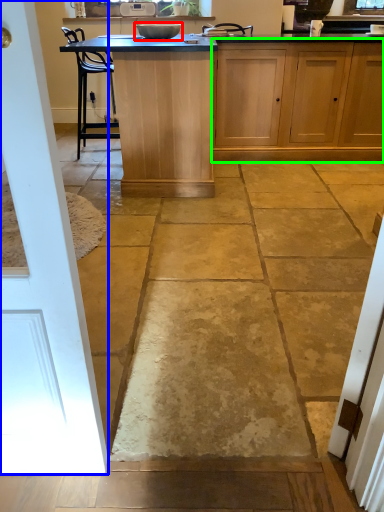
Question: Considering the real-world distances, which object is farthest from appliance (highlighted by a red box)? door (highlighted by a blue box) or cabinetry (highlighted by a green box)?

Choices:
 (A) door
 (B) cabinetry

Answer: (A)